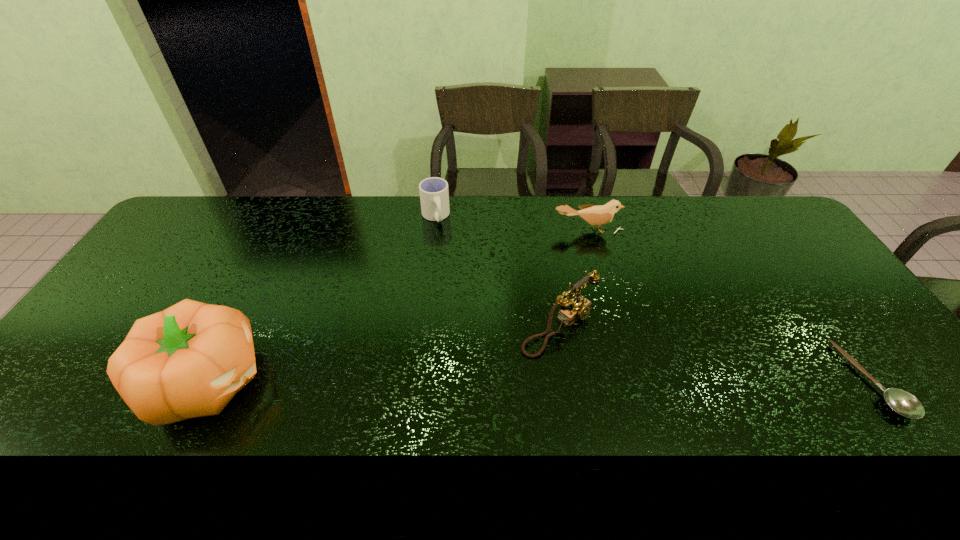
Where is `free point between the leftmost object and the telephone`? free point between the leftmost object and the telephone is located at coordinates (384, 354).

This screenshot has width=960, height=540. I want to click on free space between the fourth object from right to left and the telephone, so click(x=497, y=272).

This screenshot has width=960, height=540. In order to click on vacant region between the shortest object and the second object from left to right in this screenshot , I will do `click(654, 298)`.

Locate an element on the screen. Image resolution: width=960 pixels, height=540 pixels. free space between the cup and the bird is located at coordinates (512, 224).

Find the location of a particular element. This screenshot has height=540, width=960. blank region between the shortest object and the telephone is located at coordinates (716, 353).

Identify the location of vacant space that is in between the rightmost object and the bird. (731, 305).

I want to click on unoccupied position between the cup and the pumpkin, so click(x=322, y=299).

The width and height of the screenshot is (960, 540). In order to click on empty space between the tallest object and the bird in this screenshot , I will do `click(398, 306)`.

At what (x,y) coordinates should I click in order to perform the action: click on object that is the second closest to the cup. Please return your answer as a coordinate pair (x, y). The height and width of the screenshot is (540, 960). Looking at the image, I should click on (578, 307).

Locate which object ranks third in proximity to the bird. Please provide its 2D coordinates. Your answer should be formatted as a tuple, i.e. [(x, y)], where the tuple contains the x and y coordinates of a point satisfying the conditions above.

[(903, 403)]